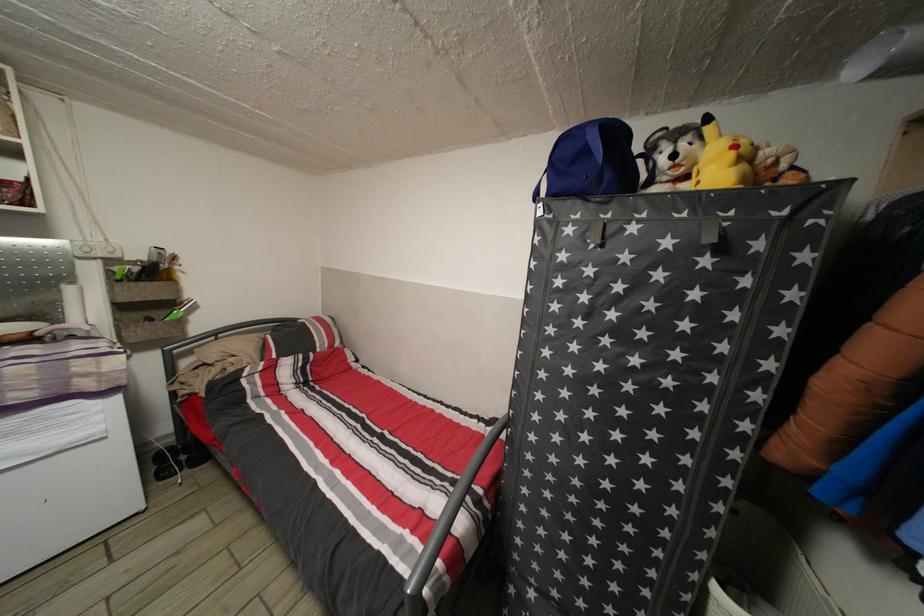
Describe the element at coordinates (712, 159) in the screenshot. Image resolution: width=924 pixels, height=616 pixels. I see `a pikachu plush toy` at that location.